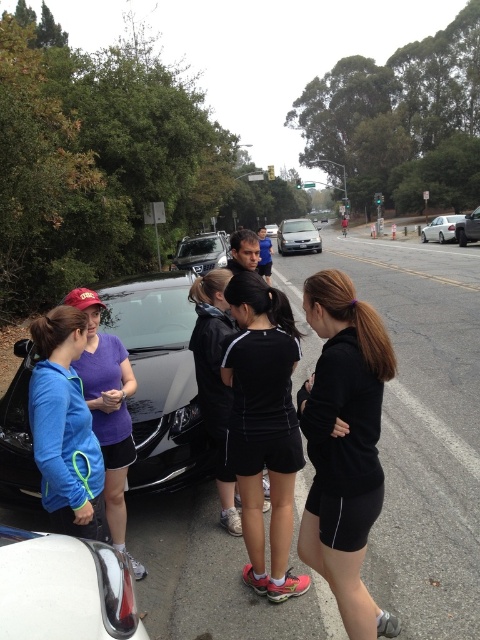
Question: Does blue fleece jacket at left appear on the left side of satin black suv at center?

Choices:
 (A) no
 (B) yes

Answer: (A)

Question: Which object is the closest to the satin black suv at center?

Choices:
 (A) shiny black car at center
 (B) silver metallic sedan at right
 (C) matte blue jacket at left
 (D) black matte car at center

Answer: (A)

Question: Which point is closer to the camera?

Choices:
 (A) satin black suv at center
 (B) black matte shorts at center
 (C) silver metallic sedan at right
 (D) black matte car at center

Answer: (B)

Question: Does black athletic shorts at center appear under shiny chrome door handle at lower left?

Choices:
 (A) no
 (B) yes

Answer: (A)

Question: Among these points, which one is nearest to the camera?

Choices:
 (A) (169, 460)
 (B) (74, 344)
 (C) (274, 234)
 (D) (207, 269)

Answer: (B)

Question: Observing the image, what is the correct spatial positioning of shiny chrome door handle at lower left in reference to black matte car at center?

Choices:
 (A) right
 (B) left

Answer: (B)